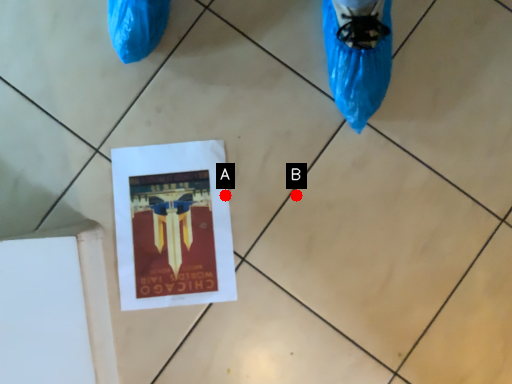
Question: Two points are circled on the image, labeled by A and B beside each circle. Which point is closer to the camera?

Choices:
 (A) A is closer
 (B) B is closer

Answer: (B)